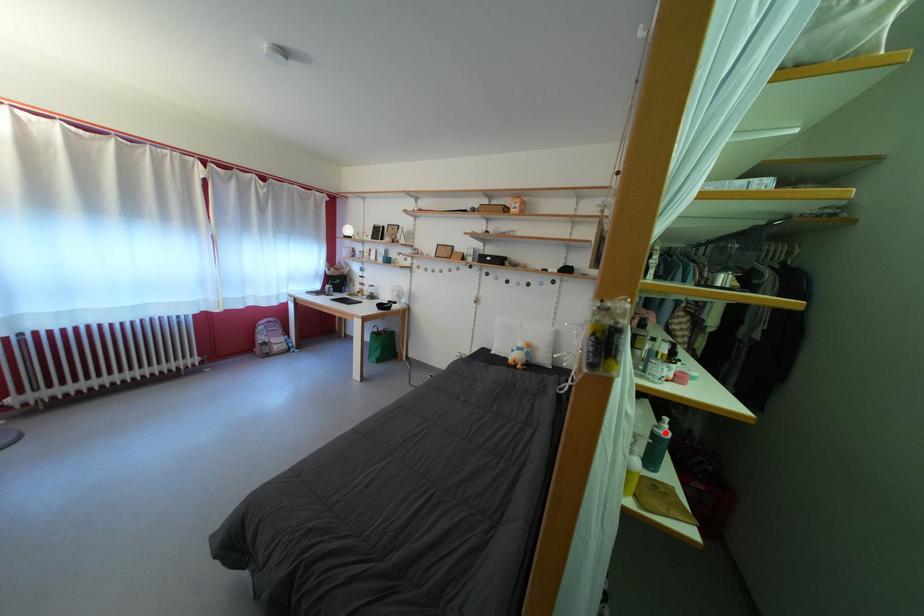
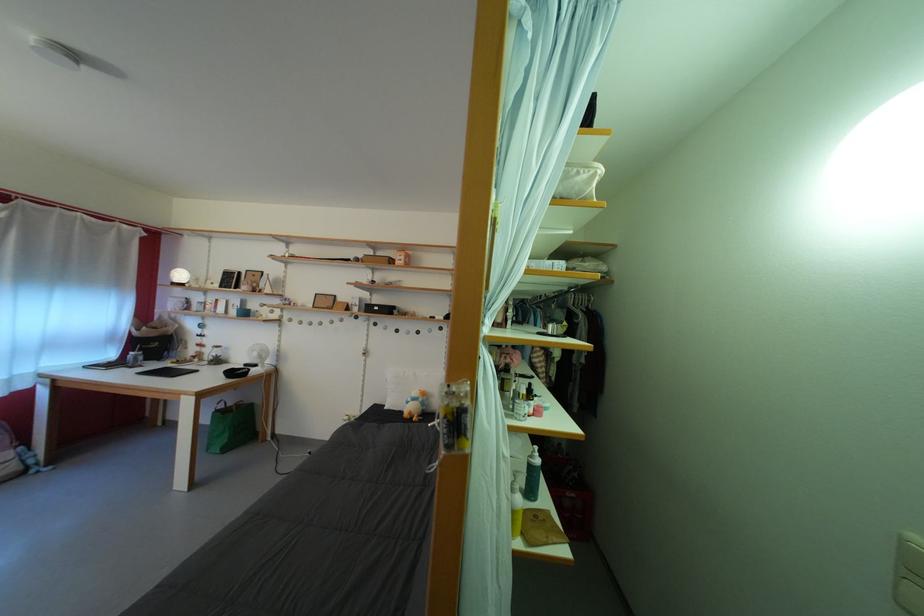
Question: I am providing you with two images of the same scene from different viewpoints. Image1 has a red point marked. In image2, the corresponding 3D location appears at what relative position? Reply with the corresponding letter.

Choices:
 (A) Closer
 (B) Farther

Answer: (B)